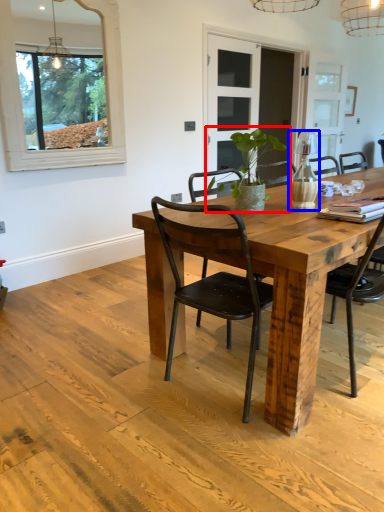
Question: Which of the following is the farthest to the observer, houseplant (highlighted by a red box) or vase (highlighted by a blue box)?

Choices:
 (A) houseplant
 (B) vase

Answer: (B)